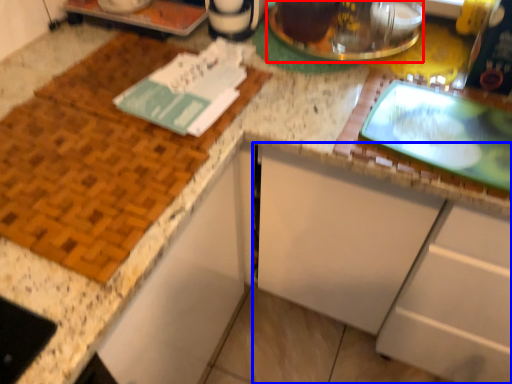
Question: Among these objects, which one is nearest to the camera, appliance (highlighted by a red box) or cabinetry (highlighted by a blue box)?

Choices:
 (A) appliance
 (B) cabinetry

Answer: (B)